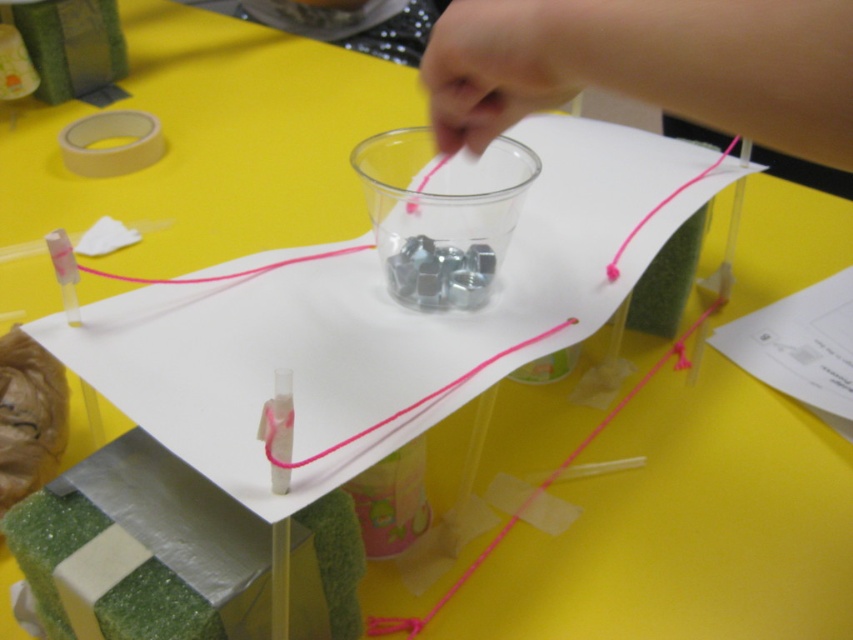
What is the location of the point with coordinates (648, 67) in the image?

The point with coordinates (648, 67) is located on the pink fabric hand at upper center.